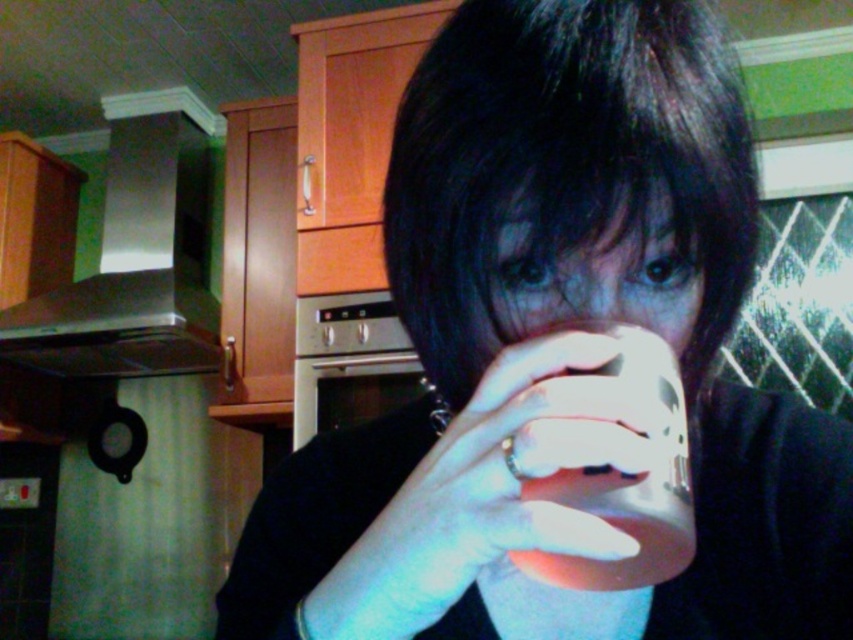
Question: Which point is farther to the camera?

Choices:
 (A) translucent plastic cup at center
 (B) matte white cup at center
 (C) satin silver exhaust hood at upper left

Answer: (C)

Question: Does white matte cup at center come in front of translucent plastic cup at center?

Choices:
 (A) no
 (B) yes

Answer: (B)

Question: Which object appears closest to the camera in this image?

Choices:
 (A) white matte cup at center
 (B) translucent plastic cup at center
 (C) satin silver exhaust hood at upper left
 (D) matte white cup at center

Answer: (A)

Question: Based on their relative distances, which object is nearer to the white matte cup at center?

Choices:
 (A) matte white cup at center
 (B) translucent plastic cup at center

Answer: (B)

Question: Is satin silver exhaust hood at upper left below translucent plastic cup at center?

Choices:
 (A) yes
 (B) no

Answer: (B)

Question: Can you confirm if satin silver exhaust hood at upper left is thinner than matte white cup at center?

Choices:
 (A) yes
 (B) no

Answer: (B)